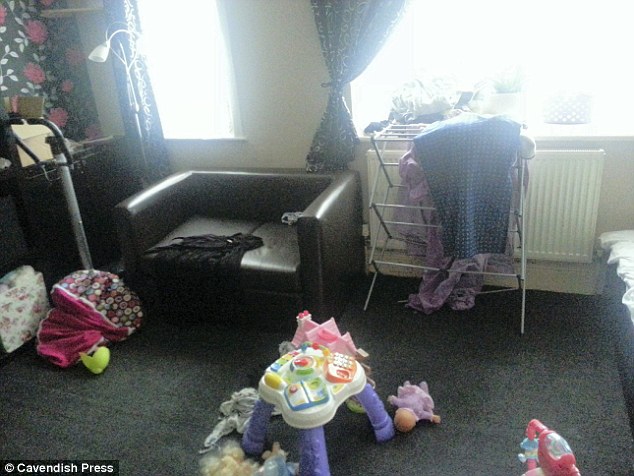
Locate an element on the screen. place to sit is located at coordinates (255, 222).